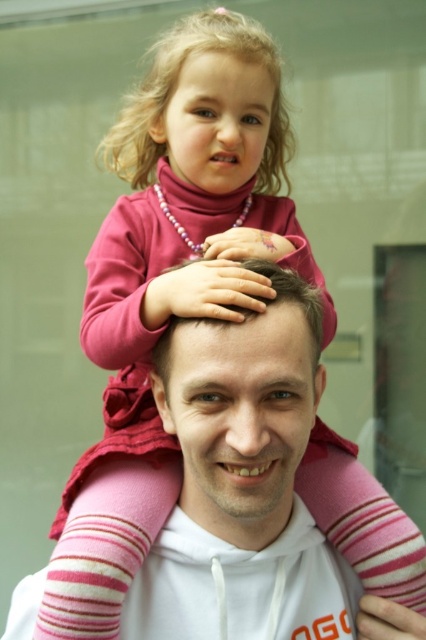
Question: Which of the following is the farthest from the observer?

Choices:
 (A) (192, 403)
 (B) (258, 64)

Answer: (B)

Question: Does pink fleece jacket at upper center have a greater width compared to pink fabric head at center?

Choices:
 (A) no
 (B) yes

Answer: (B)

Question: Is pink fleece jacket at upper center to the right of pink fabric head at center from the viewer's perspective?

Choices:
 (A) yes
 (B) no

Answer: (B)

Question: Can you confirm if pink fleece jacket at upper center is bigger than pink fabric head at center?

Choices:
 (A) yes
 (B) no

Answer: (A)

Question: Which point is closer to the camera?

Choices:
 (A) pink fleece jacket at upper center
 (B) pink fabric head at center

Answer: (B)

Question: Which point is farther to the camera?

Choices:
 (A) (189, 435)
 (B) (229, 218)

Answer: (B)